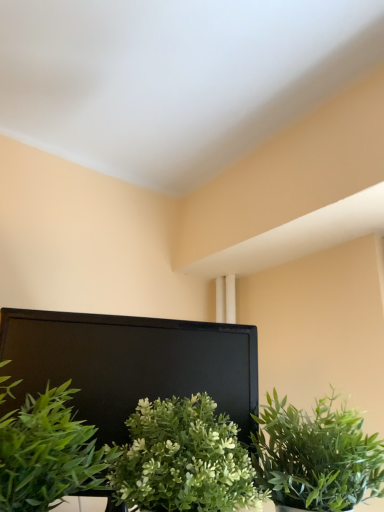
Question: From a real-world perspective, is green matte plant at center, the second houseplant in the left-to-right sequence, below green leafy plant at center, which is the 3th houseplant from left to right?

Choices:
 (A) yes
 (B) no

Answer: (A)

Question: Is green matte plant at center, the second houseplant in the left-to-right sequence, at the left side of green leafy plant at center, which is the 3th houseplant from left to right?

Choices:
 (A) no
 (B) yes

Answer: (B)

Question: Would you say green matte plant at center, the second houseplant in the left-to-right sequence, is outside green leafy plant at center, the 1th houseplant when ordered from right to left?

Choices:
 (A) no
 (B) yes

Answer: (B)

Question: Is the position of green matte plant at center, the second houseplant viewed from the right, more distant than that of green leafy plant at center, the 1th houseplant when ordered from right to left?

Choices:
 (A) no
 (B) yes

Answer: (A)

Question: Is green matte plant at center, the second houseplant viewed from the right, taller than green leafy plant at center, which is the 3th houseplant from left to right?

Choices:
 (A) yes
 (B) no

Answer: (A)

Question: Is green leafy plant at lower left, the 3th houseplant viewed from the right, inside or outside of green leafy plant at center, the 1th houseplant when ordered from right to left?

Choices:
 (A) inside
 (B) outside

Answer: (B)

Question: From the image's perspective, is green leafy plant at lower left, the 1th houseplant positioned from the left, positioned above or below green leafy plant at center, the 1th houseplant when ordered from right to left?

Choices:
 (A) below
 (B) above

Answer: (B)

Question: Considering their positions, is green leafy plant at lower left, the 3th houseplant viewed from the right, located in front of or behind green leafy plant at center, the 1th houseplant when ordered from right to left?

Choices:
 (A) front
 (B) behind

Answer: (A)

Question: From their relative heights in the image, would you say green leafy plant at lower left, the 3th houseplant viewed from the right, is taller or shorter than green leafy plant at center, which is the 3th houseplant from left to right?

Choices:
 (A) tall
 (B) short

Answer: (A)

Question: In the image, is green leafy plant at lower left, the 1th houseplant positioned from the left, positioned in front of or behind green matte plant at center, the second houseplant in the left-to-right sequence?

Choices:
 (A) behind
 (B) front

Answer: (B)

Question: From a real-world perspective, is green leafy plant at lower left, the 3th houseplant viewed from the right, physically located above or below green matte plant at center, the second houseplant in the left-to-right sequence?

Choices:
 (A) below
 (B) above

Answer: (B)

Question: Would you say green leafy plant at lower left, the 3th houseplant viewed from the right, is inside or outside green matte plant at center, the second houseplant in the left-to-right sequence?

Choices:
 (A) outside
 (B) inside

Answer: (A)

Question: Visually, is green leafy plant at lower left, the 3th houseplant viewed from the right, positioned to the left or to the right of green matte plant at center, the second houseplant viewed from the right?

Choices:
 (A) left
 (B) right

Answer: (A)

Question: Is green leafy plant at center, which is the 3th houseplant from left to right, in front of or behind green matte plant at center, the second houseplant in the left-to-right sequence, in the image?

Choices:
 (A) behind
 (B) front

Answer: (A)

Question: Is green leafy plant at center, the 1th houseplant when ordered from right to left, taller or shorter than green matte plant at center, the second houseplant in the left-to-right sequence?

Choices:
 (A) short
 (B) tall

Answer: (A)